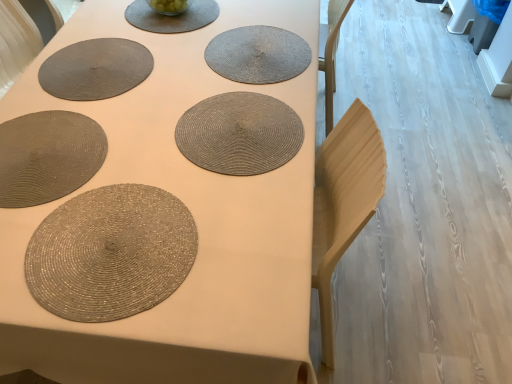
Locate an element on the screen. vacant region below matte gray placemat at upper left, placed as the first paper plate when sorted from back to front (from a real-world perspective) is located at coordinates (92, 62).